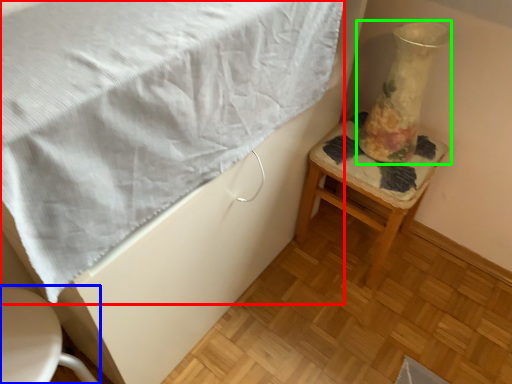
Question: Based on their relative distances, which object is farther from blanket (highlighted by a red box)? Choose from furniture (highlighted by a blue box) and vase (highlighted by a green box).

Choices:
 (A) furniture
 (B) vase

Answer: (B)